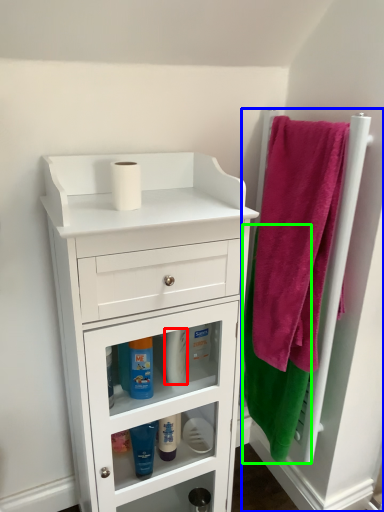
Question: Which is farther away from toiletry (highlighted by a red box)? door (highlighted by a blue box) or bath towel (highlighted by a green box)?

Choices:
 (A) door
 (B) bath towel

Answer: (A)